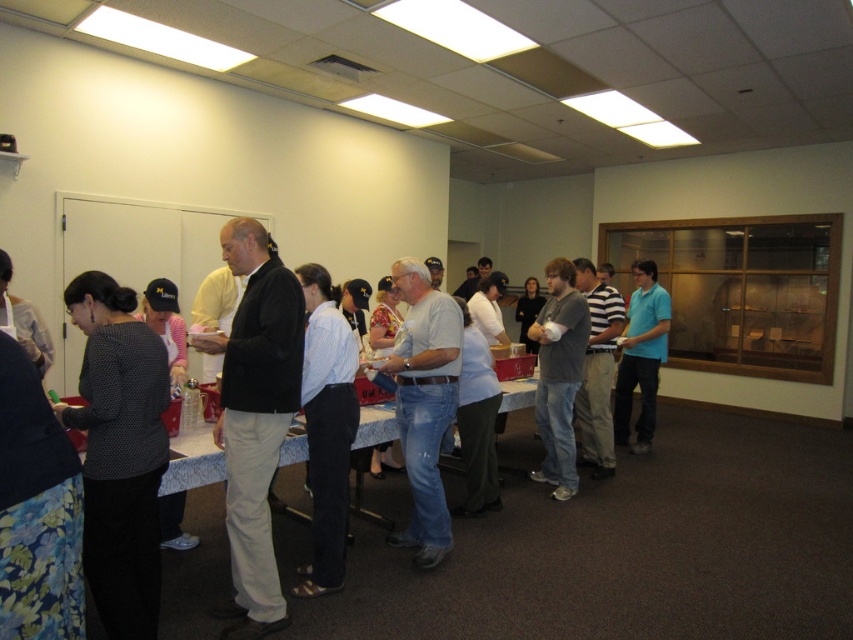
You are a photographer trying to capture a group photo of the light blue striped shirt at center and the blue cotton shirt at center. Which person should you position closer to the camera to ensure both appear equally tall in the photo?

The light blue striped shirt at center has a lesser height compared to blue cotton shirt at center, so you should position the light blue striped shirt at center closer to the camera to make them appear the same height in the photo.

You are standing in the room and want to move from the point at coordinates (566, 426) to the point at coordinates (642, 339). Which direction should you move to get closer to your destination?

To move from point (566, 426) to point (642, 339), you should move backward since point (566, 426) is closer to the viewer than point (642, 339).